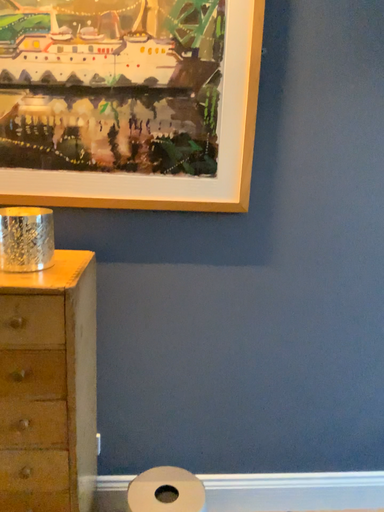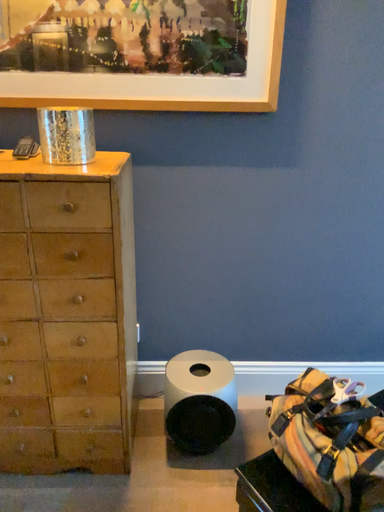
Question: How did the camera likely rotate when shooting the video?

Choices:
 (A) rotated downward
 (B) rotated upward

Answer: (A)